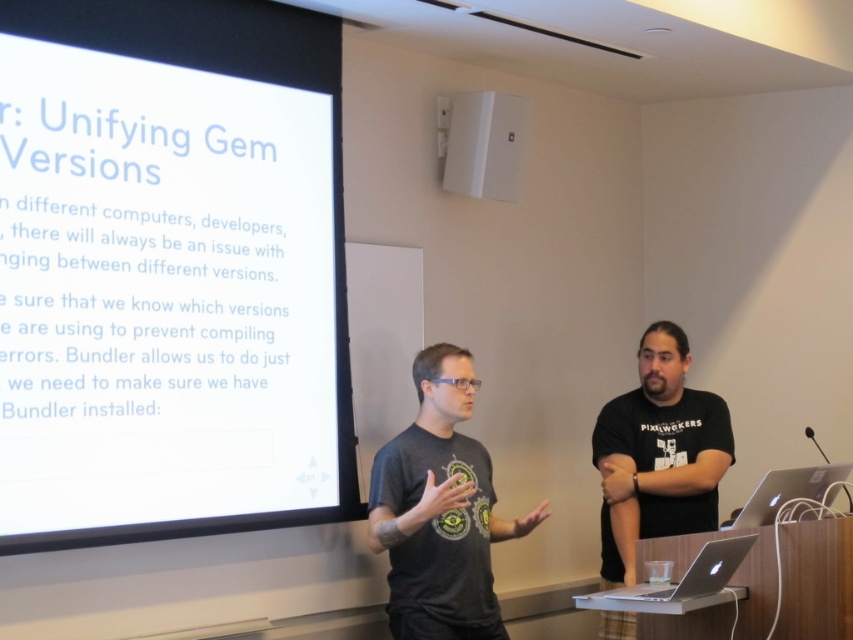
Which is behind, point (428, 554) or point (685, 458)?

The point (685, 458) is more distant.

Image resolution: width=853 pixels, height=640 pixels. Describe the element at coordinates (439, 509) in the screenshot. I see `dark gray t-shirt at center` at that location.

Is point (413, 500) positioned in front of point (624, 584)?

Yes, point (413, 500) is in front of point (624, 584).

I want to click on dark gray t-shirt at center, so click(x=439, y=509).

Can you confirm if white matte projector screen at upper left is bigger than white plastic speaker at upper center?

Indeed, white matte projector screen at upper left has a larger size compared to white plastic speaker at upper center.

Does white matte projector screen at upper left have a smaller size compared to white plastic speaker at upper center?

No, white matte projector screen at upper left is not smaller than white plastic speaker at upper center.

Which is in front, point (120, 49) or point (468, 168)?

Point (120, 49) is more forward.

Where is `white matte projector screen at upper left`? This screenshot has height=640, width=853. white matte projector screen at upper left is located at coordinates (170, 272).

Who is shorter, white matte projector screen at upper left or black matte t-shirt at center?

Standing shorter between the two is black matte t-shirt at center.

Is white matte projector screen at upper left positioned behind black matte t-shirt at center?

No, white matte projector screen at upper left is in front of black matte t-shirt at center.

The image size is (853, 640). What are the coordinates of `white matte projector screen at upper left` in the screenshot? It's located at (170, 272).

At what (x,y) coordinates should I click in order to perform the action: click on white matte projector screen at upper left. Please return your answer as a coordinate pair (x, y). Looking at the image, I should click on (170, 272).